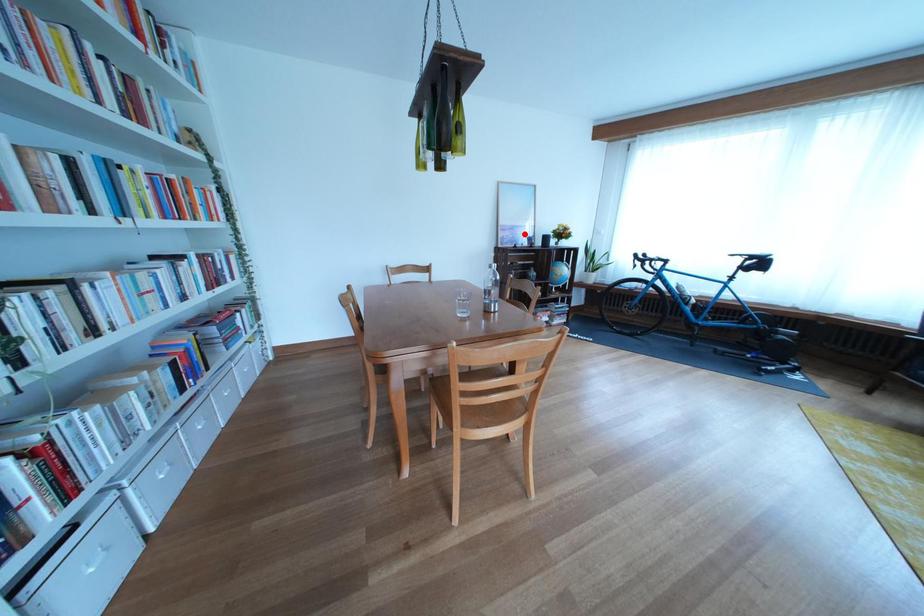
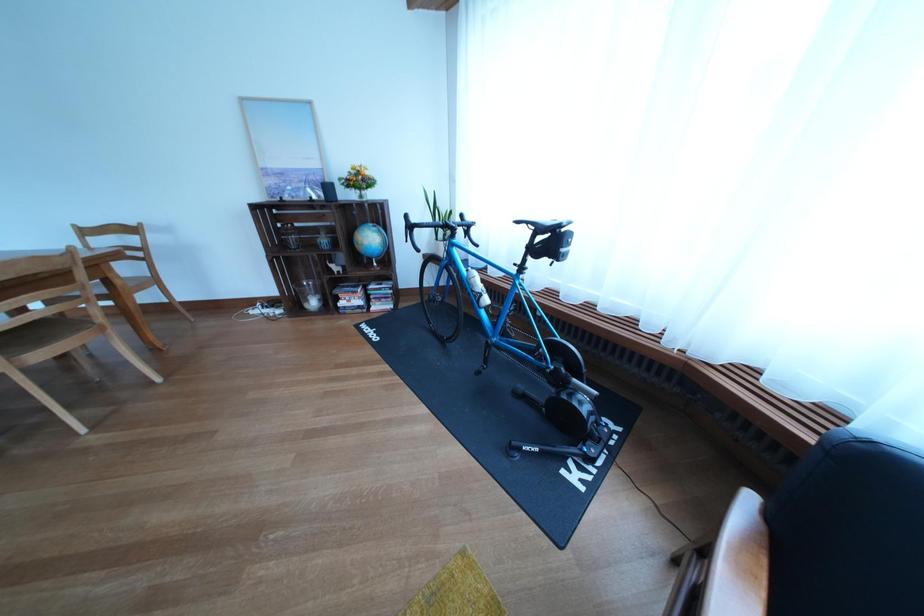
Where in the second image is the point corresponding to the highlighted location from the first image?

(294, 179)